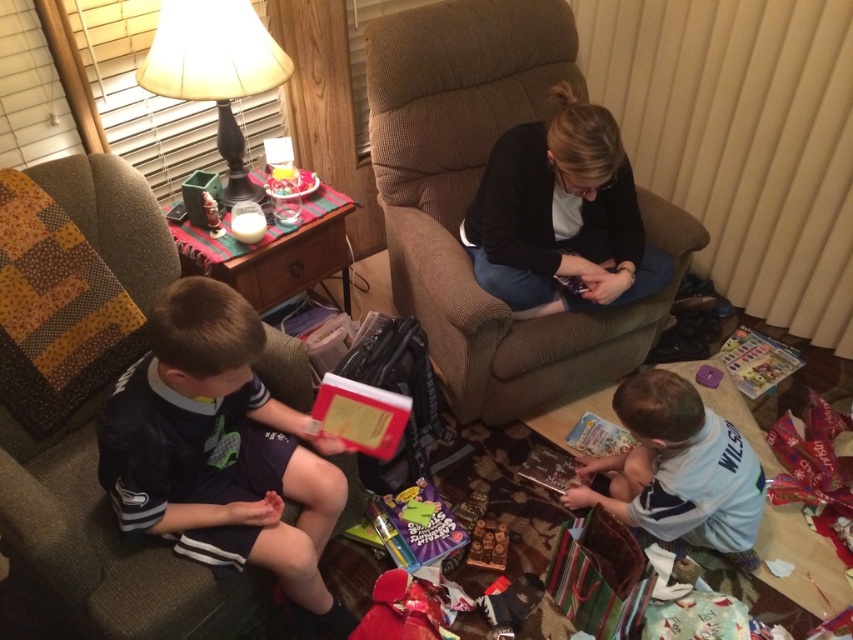
Question: Which of the following is the farthest from the observer?

Choices:
 (A) brown fabric chair at center
 (B) white matte shirt at lower right
 (C) wooden toy at lower center
 (D) black sweater at upper center

Answer: (C)

Question: Can you confirm if black sweater at upper center is positioned to the right of purple plastic toy at lower right?

Choices:
 (A) no
 (B) yes

Answer: (A)

Question: Is white matte shirt at lower right above purple plastic toy at lower right?

Choices:
 (A) no
 (B) yes

Answer: (A)

Question: Does dark blue jersey at left lie in front of black sweater at upper center?

Choices:
 (A) yes
 (B) no

Answer: (A)

Question: Which point is closer to the camera taking this photo?

Choices:
 (A) (604, 237)
 (B) (729, 532)

Answer: (B)

Question: Which point appears closest to the camera in this image?

Choices:
 (A) (241, 33)
 (B) (727, 451)
 (C) (196, 296)

Answer: (C)